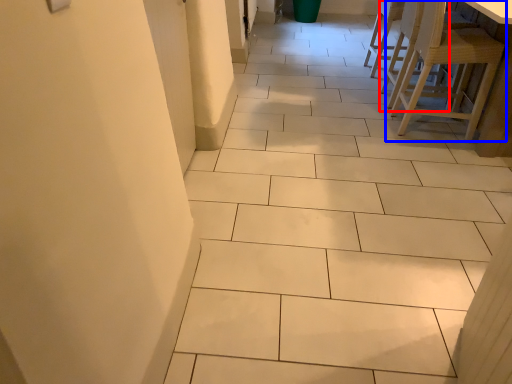
Question: Which object appears closest to the camera in this image, chair (highlighted by a red box) or chair (highlighted by a blue box)?

Choices:
 (A) chair
 (B) chair

Answer: (B)